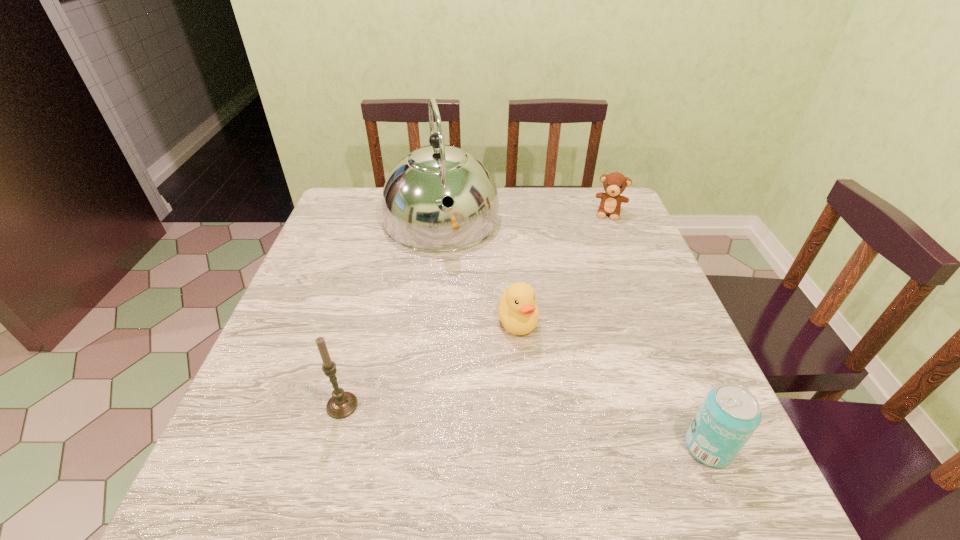
Image resolution: width=960 pixels, height=540 pixels. I want to click on vacant spot on the desktop that is between the fourth farthest object and the nearest object and is positioned on the face of the duckling, so click(540, 428).

Identify the location of free space on the desktop that is between the candle and the beer can and is positioned from the spout of the tallest object. (488, 422).

This screenshot has width=960, height=540. What are the coordinates of `free spot on the desktop that is between the second tallest object and the beer can and is positioned on the face of the teddy bear` in the screenshot? It's located at (564, 431).